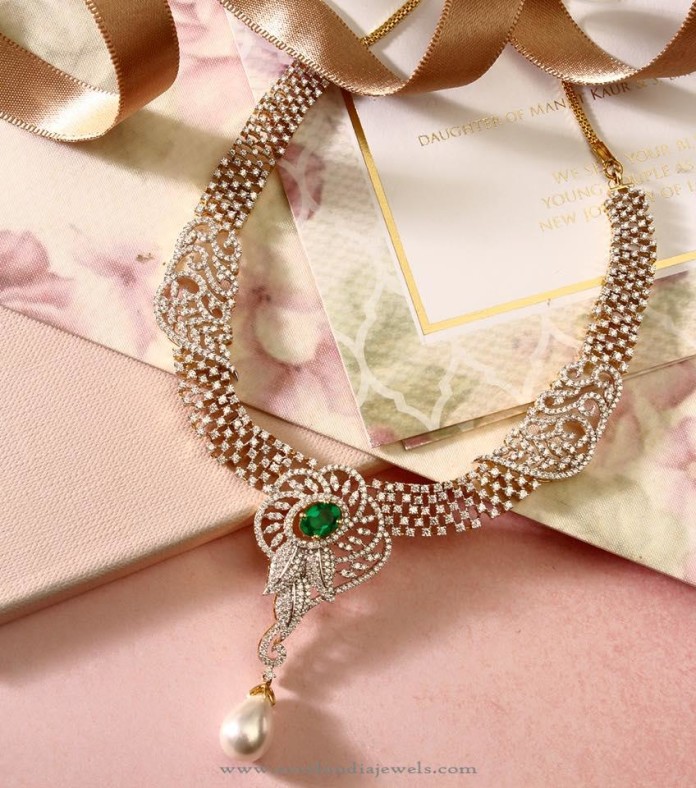
Locate an element on the screen. Image resolution: width=696 pixels, height=788 pixels. canvas is located at coordinates (148, 470).